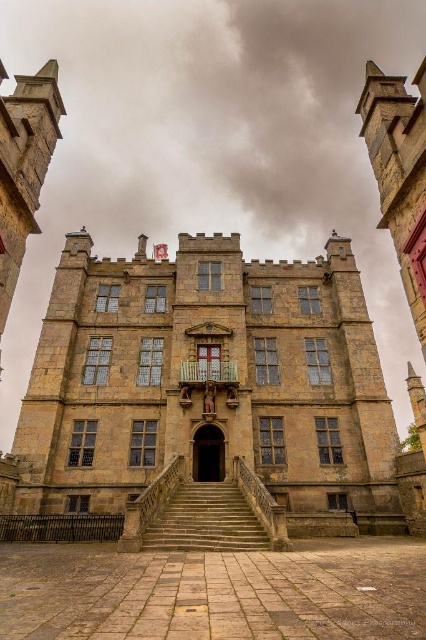
Question: Can you confirm if stone castle at center is smaller than stone textured stairs at center?

Choices:
 (A) yes
 (B) no

Answer: (B)

Question: Which object is the closest to the brown stone archway at center?

Choices:
 (A) stone textured stairs at center
 (B) stone castle at center

Answer: (A)

Question: Which object is positioned farthest from the brown stone archway at center?

Choices:
 (A) stone textured stairs at center
 (B) stone castle at center

Answer: (B)

Question: Does stone textured stairs at center have a lesser width compared to brown stone archway at center?

Choices:
 (A) yes
 (B) no

Answer: (B)

Question: Which object is closer to the camera taking this photo?

Choices:
 (A) stone castle at center
 (B) stone textured stairs at center
 (C) brown stone archway at center

Answer: (B)

Question: Can you confirm if stone textured stairs at center is positioned to the right of brown stone archway at center?

Choices:
 (A) yes
 (B) no

Answer: (A)